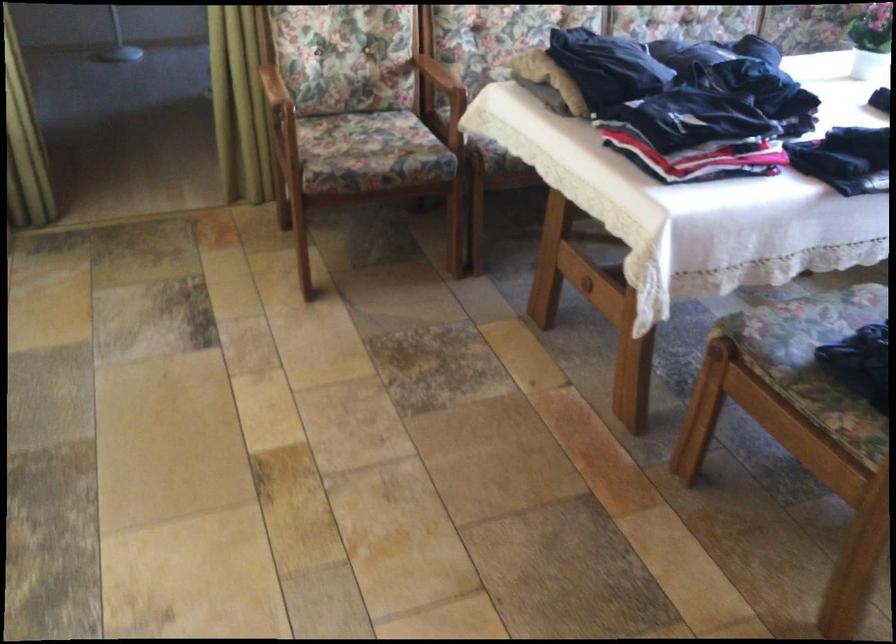
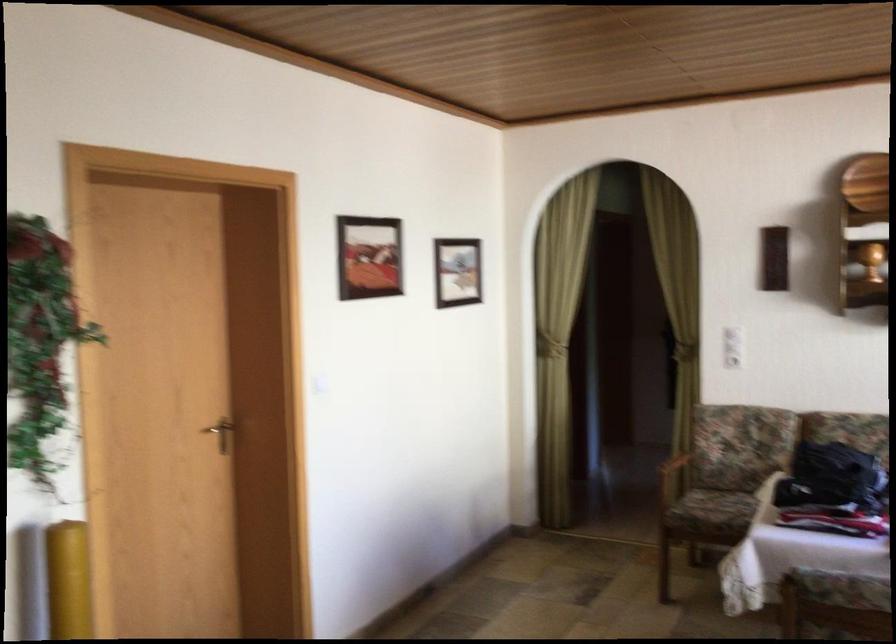
Find the pixel in the second image that matches (367,151) in the first image.

(725, 507)